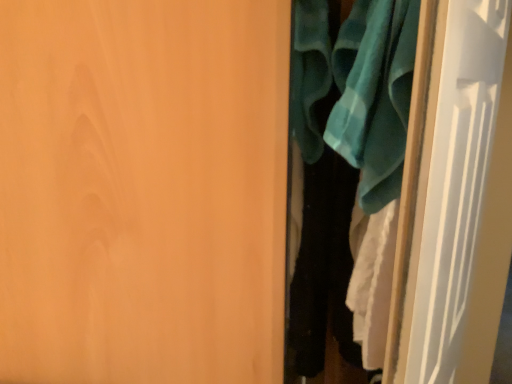
Question: Is matte wood door at center, arranged as the first door when viewed from the left, located outside teal fabric clothes at right?

Choices:
 (A) yes
 (B) no

Answer: (A)

Question: Are matte wood door at center, arranged as the first door when viewed from the left, and teal fabric clothes at right making contact?

Choices:
 (A) yes
 (B) no

Answer: (B)

Question: Does matte wood door at center, marked as the 2th door in a right-to-left arrangement, appear on the right side of teal fabric clothes at right?

Choices:
 (A) yes
 (B) no

Answer: (B)

Question: Considering the relative sizes of matte wood door at center, arranged as the first door when viewed from the left, and teal fabric clothes at right in the image provided, is matte wood door at center, arranged as the first door when viewed from the left, shorter than teal fabric clothes at right?

Choices:
 (A) yes
 (B) no

Answer: (B)

Question: From the image's perspective, would you say matte wood door at center, marked as the 2th door in a right-to-left arrangement, is shown under teal fabric clothes at right?

Choices:
 (A) no
 (B) yes

Answer: (B)

Question: Does matte wood door at center, arranged as the first door when viewed from the left, have a smaller size compared to teal fabric clothes at right?

Choices:
 (A) no
 (B) yes

Answer: (A)

Question: Would you consider teal fabric clothes at right to be distant from teal fabric bath towel at upper right?

Choices:
 (A) no
 (B) yes

Answer: (A)

Question: From the image's perspective, is teal fabric clothes at right located beneath teal fabric bath towel at upper right?

Choices:
 (A) yes
 (B) no

Answer: (A)

Question: Does teal fabric clothes at right have a greater width compared to teal fabric bath towel at upper right?

Choices:
 (A) yes
 (B) no

Answer: (B)

Question: Is teal fabric clothes at right further to camera compared to teal fabric bath towel at upper right?

Choices:
 (A) no
 (B) yes

Answer: (B)

Question: Is teal fabric clothes at right positioned in front of teal fabric bath towel at upper right?

Choices:
 (A) yes
 (B) no

Answer: (B)

Question: From a real-world perspective, is teal fabric clothes at right positioned over teal fabric bath towel at upper right based on gravity?

Choices:
 (A) yes
 (B) no

Answer: (B)

Question: Considering the relative sizes of white glossy door at right, which ranks as the 1th door in right-to-left order, and teal fabric bath towel at upper right in the image provided, is white glossy door at right, which ranks as the 1th door in right-to-left order, wider than teal fabric bath towel at upper right?

Choices:
 (A) no
 (B) yes

Answer: (B)